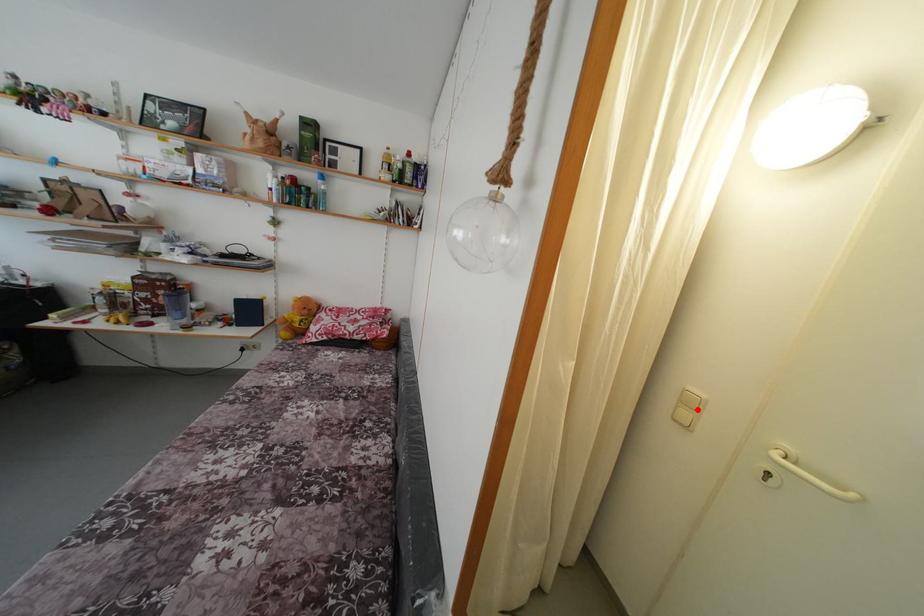
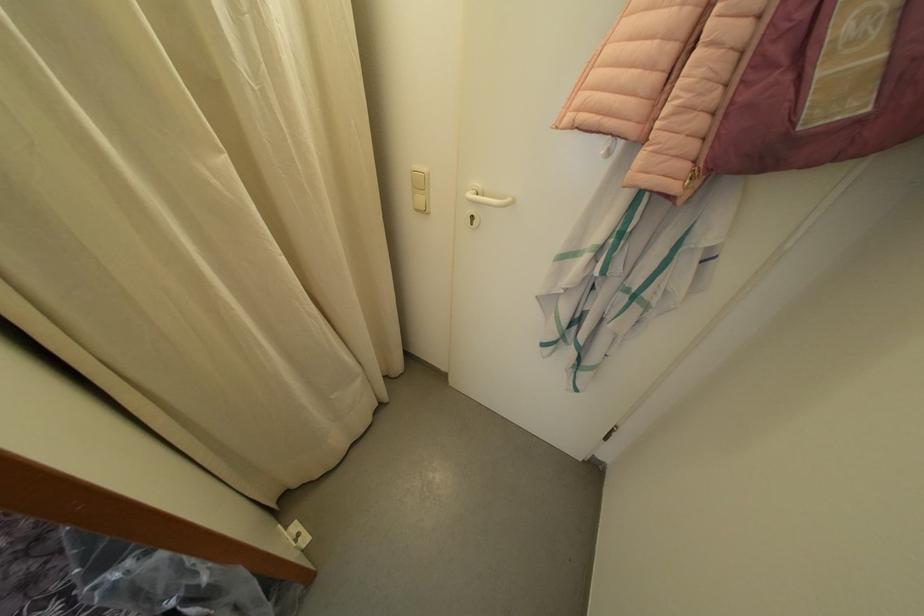
Question: I am providing you with two images of the same scene from different viewpoints. A red point is marked on the first image. Can you still see the location of the red point in image 2?

Choices:
 (A) Yes
 (B) No

Answer: (A)